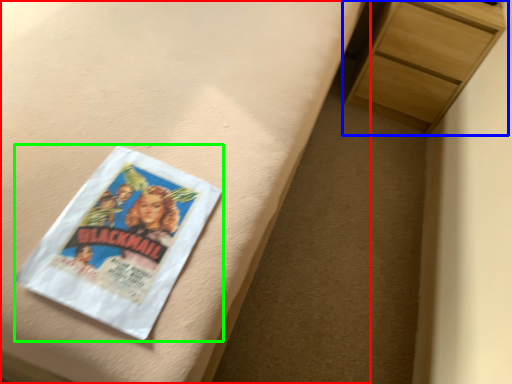
Question: Which is farther away from bed frame (highlighted by a red box)? chest of drawers (highlighted by a blue box) or paperback book (highlighted by a green box)?

Choices:
 (A) chest of drawers
 (B) paperback book

Answer: (A)